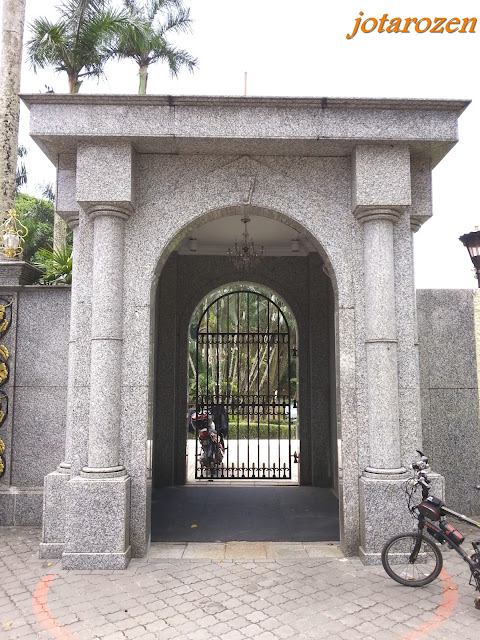
Where is `entry way`? entry way is located at coordinates click(205, 493), click(168, 388), click(315, 349).